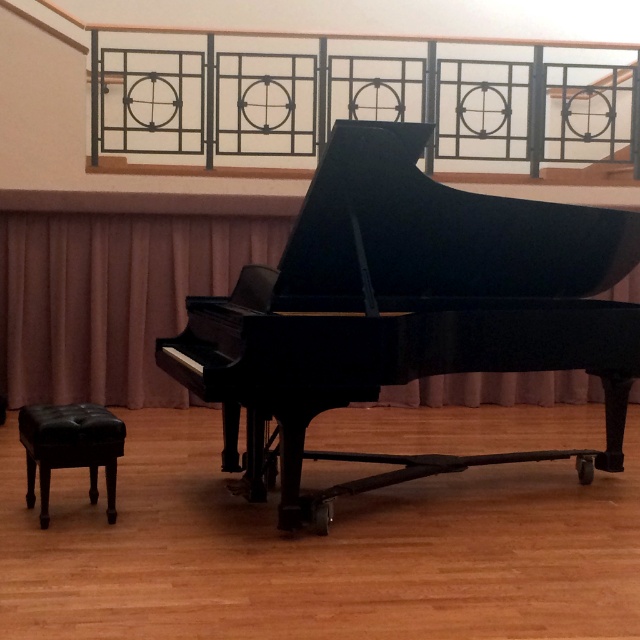
Can you confirm if metallic black railing at upper center is taller than black leather stool at lower left?

Yes, metallic black railing at upper center is taller than black leather stool at lower left.

Who is higher up, metallic black railing at upper center or black leather stool at lower left?

Positioned higher is metallic black railing at upper center.

Does point (483, 131) come behind point (61, 445)?

Yes.

Locate an element on the screen. Image resolution: width=640 pixels, height=640 pixels. metallic black railing at upper center is located at coordinates (358, 97).

In the scene shown: Does metallic black railing at upper center have a lesser width compared to matte pink curtain at center?

No.

The width and height of the screenshot is (640, 640). What do you see at coordinates (358, 97) in the screenshot?
I see `metallic black railing at upper center` at bounding box center [358, 97].

Where is `metallic black railing at upper center`? The width and height of the screenshot is (640, 640). metallic black railing at upper center is located at coordinates (358, 97).

Image resolution: width=640 pixels, height=640 pixels. I want to click on metallic black railing at upper center, so click(358, 97).

Measure the distance from matte pink curtain at center to black leather stool at lower left.

matte pink curtain at center is 2.78 meters from black leather stool at lower left.

Measure the distance between point (x=22, y=310) and camera.

Point (x=22, y=310) and camera are 6.98 meters apart.

Between point (536, 376) and point (115, 474), which one is positioned in front?

Point (115, 474)

Identify the location of matte pink curtain at center. (112, 298).